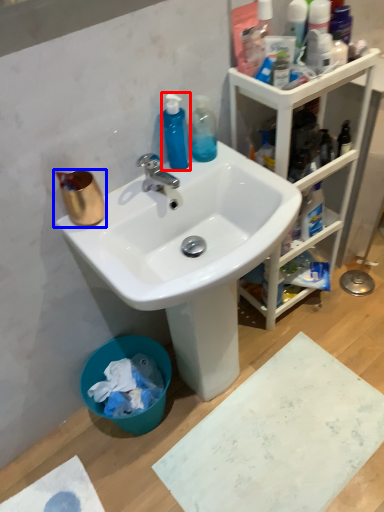
Question: Which of the following is the farthest to the observer, cleaning product (highlighted by a red box) or coffee cup (highlighted by a blue box)?

Choices:
 (A) cleaning product
 (B) coffee cup

Answer: (A)